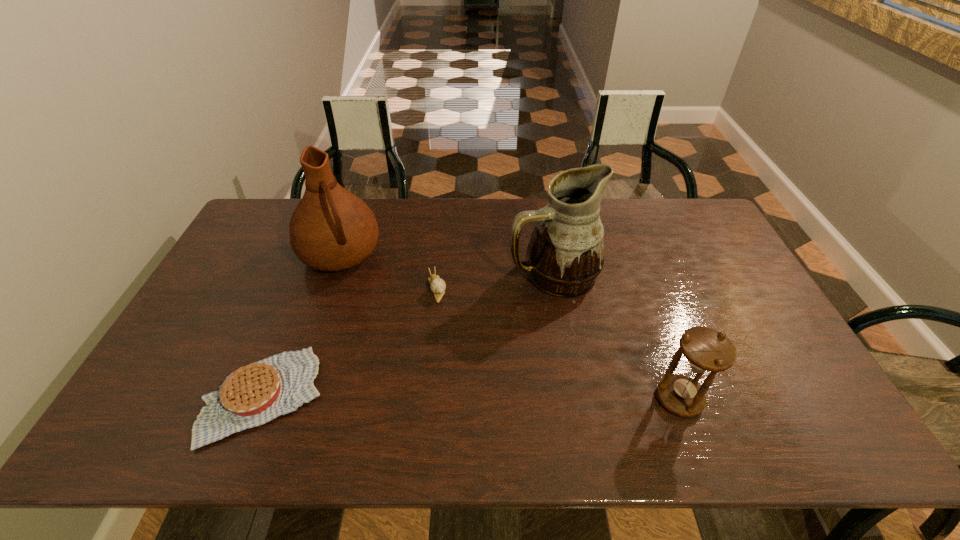
At what (x,y) coordinates should I click in order to perform the action: click on pie. Please return your answer as a coordinate pair (x, y). The image size is (960, 540). Looking at the image, I should click on (252, 395).

The image size is (960, 540). Find the location of `the third tallest object`. the third tallest object is located at coordinates (705, 349).

The height and width of the screenshot is (540, 960). Find the location of `the rightmost object`. the rightmost object is located at coordinates (705, 349).

The height and width of the screenshot is (540, 960). I want to click on escargot, so click(437, 285).

This screenshot has width=960, height=540. Find the location of `the left pitcher`. the left pitcher is located at coordinates (331, 229).

I want to click on the right pitcher, so click(565, 255).

What are the coordinates of `vacant space located on the right of the pie` in the screenshot? It's located at (358, 396).

This screenshot has height=540, width=960. In order to click on vacant space positioned on the right of the third shortest object in this screenshot , I will do `click(768, 399)`.

Identify the location of vacant space situated 0.180m on the shell of the third object from right to left. (457, 349).

What are the coordinates of `vacant space located 0.290m on the shell of the third object from right to left` in the screenshot? It's located at (469, 383).